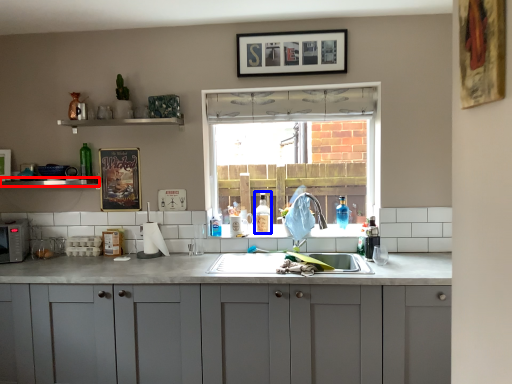
Question: Which point is further to the camera, window sill (highlighted by a red box) or bottle (highlighted by a blue box)?

Choices:
 (A) window sill
 (B) bottle

Answer: (B)